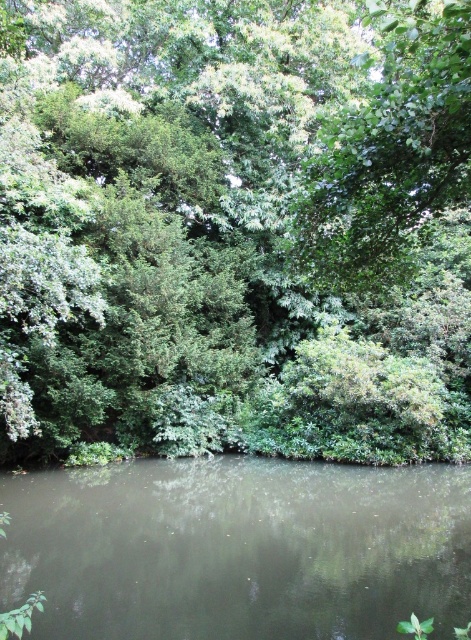
Question: Does green leafy tree at center appear on the right side of green leafy water at center?

Choices:
 (A) no
 (B) yes

Answer: (B)

Question: Does green leafy tree at center appear under green leafy water at center?

Choices:
 (A) no
 (B) yes

Answer: (A)

Question: Is green leafy tree at center thinner than green leafy water at center?

Choices:
 (A) no
 (B) yes

Answer: (A)

Question: Which object appears farthest from the camera in this image?

Choices:
 (A) green leafy tree at center
 (B) green leafy water at center

Answer: (B)

Question: Which of the following is the farthest from the observer?

Choices:
 (A) (388, 500)
 (B) (352, 64)

Answer: (B)

Question: Among these points, which one is nearest to the camera?

Choices:
 (A) (55, 534)
 (B) (302, 328)

Answer: (A)